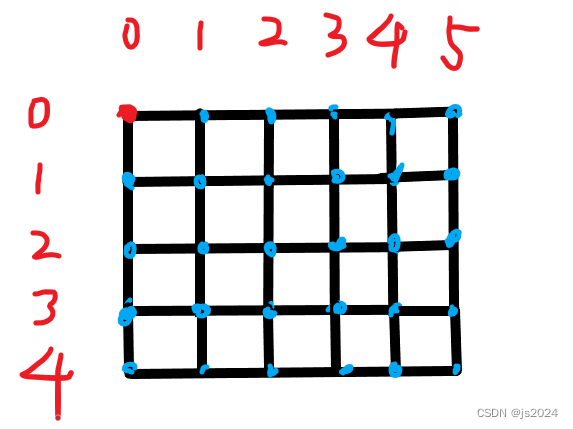
Identify the location of corners. The image size is (573, 429). (459, 369), (451, 109), (125, 107), (132, 368).